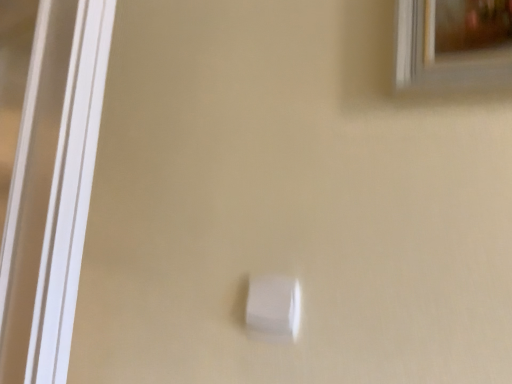
Question: Should I look upward or downward to see matte gold frame at upper right?

Choices:
 (A) up
 (B) down

Answer: (A)

Question: Does matte gold frame at upper right have a smaller size compared to white plastic light switch at center?

Choices:
 (A) no
 (B) yes

Answer: (A)

Question: Could you tell me if matte gold frame at upper right is turned towards white plastic light switch at center?

Choices:
 (A) yes
 (B) no

Answer: (B)

Question: Is matte gold frame at upper right wider than white plastic light switch at center?

Choices:
 (A) yes
 (B) no

Answer: (A)

Question: Does matte gold frame at upper right touch white plastic light switch at center?

Choices:
 (A) no
 (B) yes

Answer: (A)

Question: From the image's perspective, is matte gold frame at upper right under white plastic light switch at center?

Choices:
 (A) no
 (B) yes

Answer: (A)

Question: Does matte gold frame at upper right lie in front of white plastic light switch at center?

Choices:
 (A) yes
 (B) no

Answer: (A)

Question: Does white plastic light switch at center appear on the left side of matte gold frame at upper right?

Choices:
 (A) yes
 (B) no

Answer: (A)

Question: From the image's perspective, is white plastic light switch at center beneath matte gold frame at upper right?

Choices:
 (A) no
 (B) yes

Answer: (B)

Question: Is white plastic light switch at center positioned before matte gold frame at upper right?

Choices:
 (A) no
 (B) yes

Answer: (A)

Question: Is white plastic light switch at center bigger than matte gold frame at upper right?

Choices:
 (A) no
 (B) yes

Answer: (A)

Question: Is white plastic light switch at center touching matte gold frame at upper right?

Choices:
 (A) yes
 (B) no

Answer: (B)

Question: From a real-world perspective, is white plastic light switch at center located beneath matte gold frame at upper right?

Choices:
 (A) yes
 (B) no

Answer: (A)

Question: Would you say matte gold frame at upper right is inside or outside white plastic light switch at center?

Choices:
 (A) outside
 (B) inside

Answer: (A)